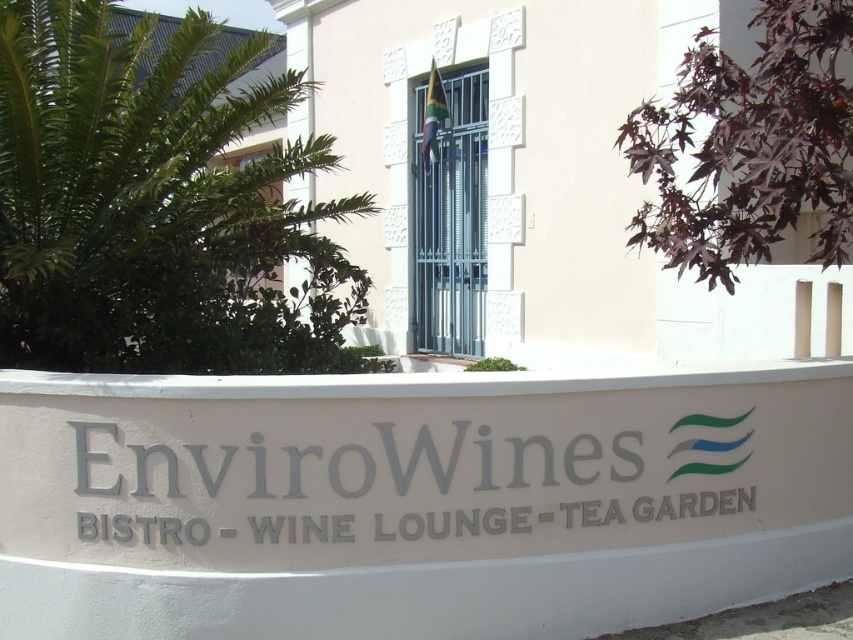
Who is more distant from viewer, (149, 468) or (428, 90)?

Point (428, 90)

How distant is gray metallic sign at center from metallic gate at center?

gray metallic sign at center and metallic gate at center are 6.34 meters apart.

Where is `gray metallic sign at center`? gray metallic sign at center is located at coordinates (352, 465).

What are the coordinates of `gray metallic sign at center` in the screenshot? It's located at (352, 465).